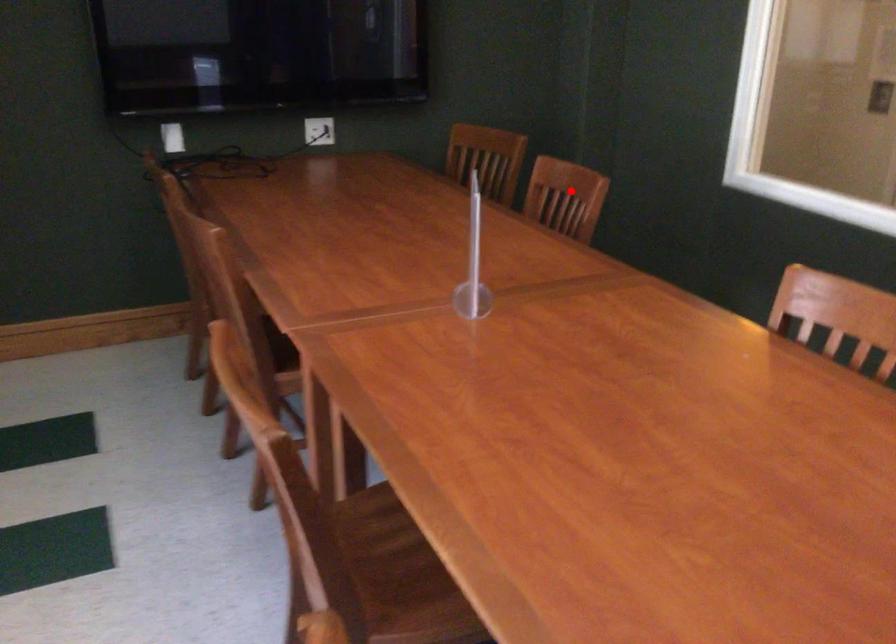
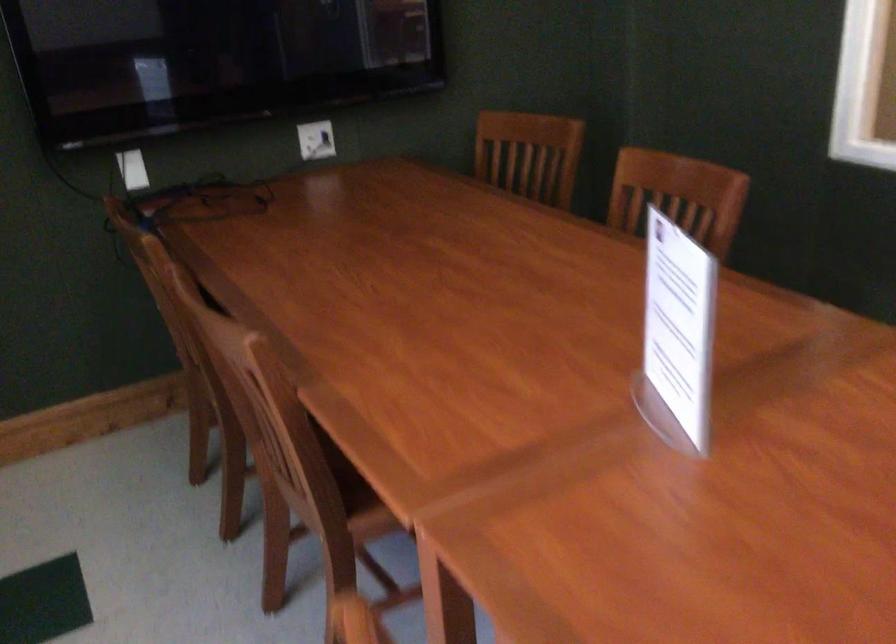
Locate, in the second image, the point that corresponds to the highlighted location in the first image.

(677, 196)